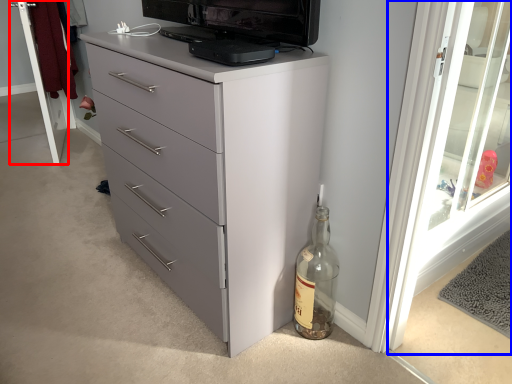
Question: Which point is closer to the camera, screen door (highlighted by a red box) or screen door (highlighted by a blue box)?

Choices:
 (A) screen door
 (B) screen door

Answer: (B)